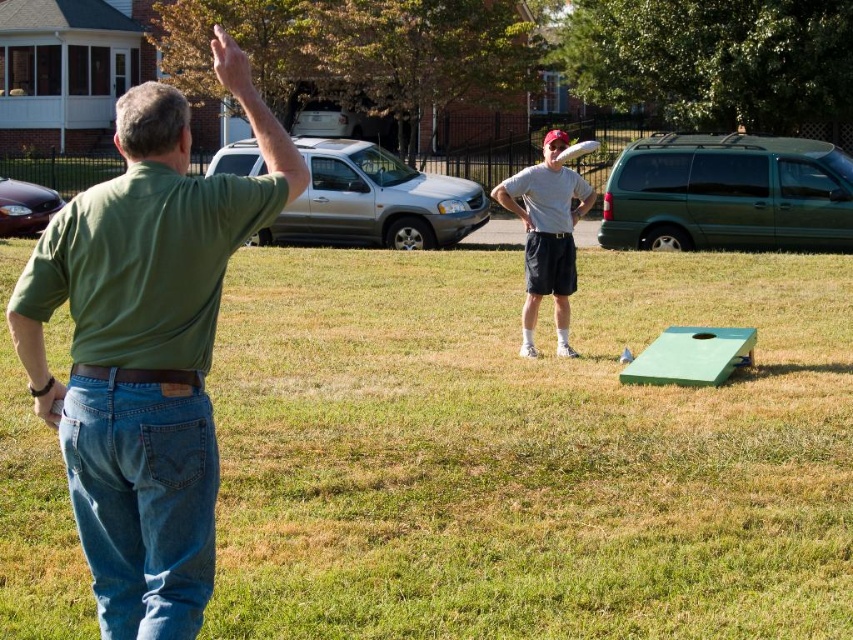
You are standing at the camera position and want to throw a bean bag to the point marked as point [374,324]. The maximum distance you can throw is 35 feet. Can you reach the point with your throw?

The point [374,324] is 37.03 feet away from the camera, which exceeds your maximum throwing distance of 35 feet. Therefore, you cannot reach the point with your throw.